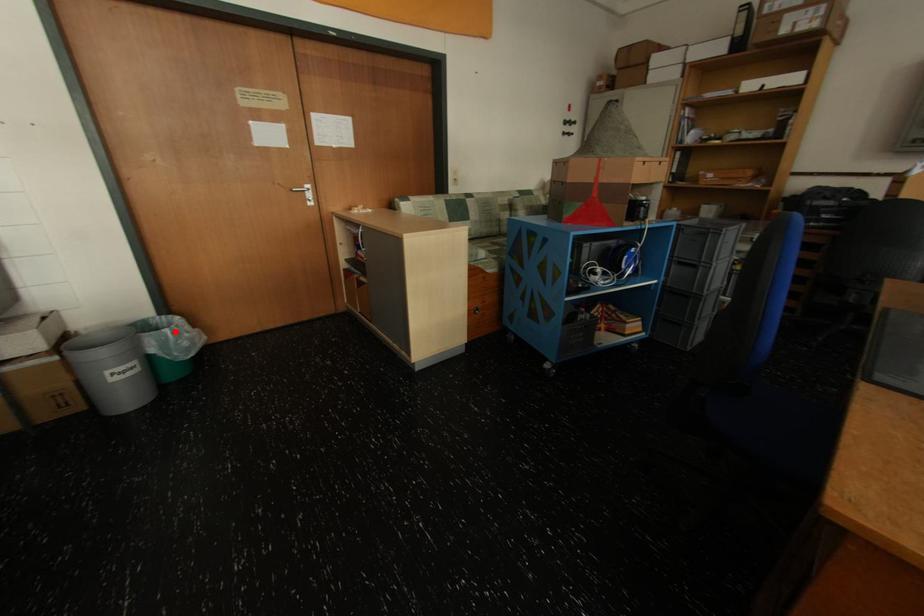
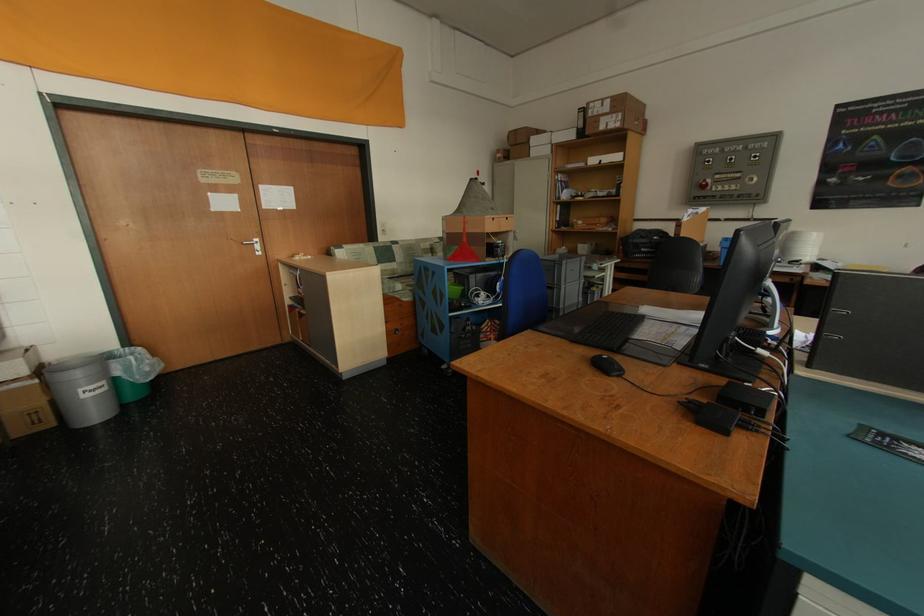
Question: I am providing you with two images of the same scene from different viewpoints. A red point is shown in image1. For the corresponding object point in image2, is it positioned nearer or farther from the camera?

Choices:
 (A) Nearer
 (B) Farther

Answer: (B)